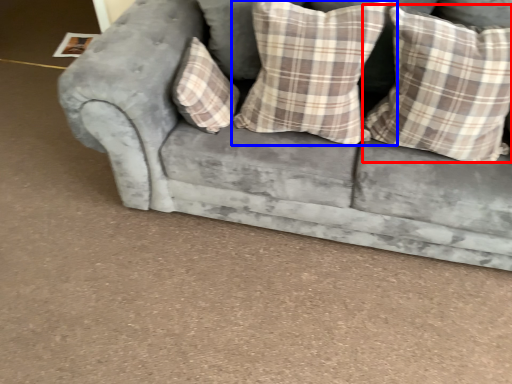
Question: Which point is closer to the camera, pillow (highlighted by a red box) or pillow (highlighted by a blue box)?

Choices:
 (A) pillow
 (B) pillow

Answer: (A)